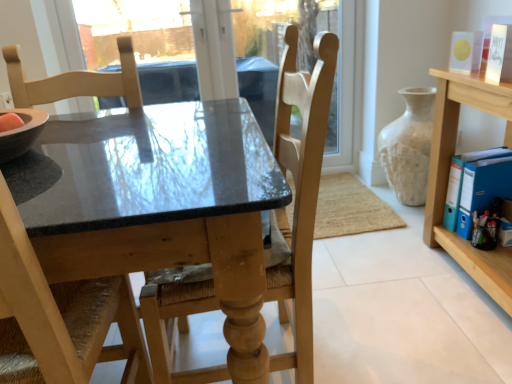
Describe the element at coordinates (157, 194) in the screenshot. This screenshot has height=384, width=512. I see `matte black table at center` at that location.

Describe the element at coordinates (448, 176) in the screenshot. I see `light wood shelf at right` at that location.

What is the approximate width of white textured vase at right?

The width of white textured vase at right is 14.23 inches.

What do you see at coordinates (409, 146) in the screenshot? This screenshot has width=512, height=384. I see `white textured vase at right` at bounding box center [409, 146].

The height and width of the screenshot is (384, 512). What are the coordinates of `wooden chair at center, placed as the 2th chair when sorted from left to right` in the screenshot? It's located at (300, 190).

Is white textured vase at right surrounded by wooden chair at center, placed as the 2th chair when sorted from left to right?

Definitely not — white textured vase at right is not inside wooden chair at center, placed as the 2th chair when sorted from left to right.

From the image's perspective, would you say wooden chair at center, the 1th chair when ordered from right to left, is positioned over white textured vase at right?

No, from the image's perspective, wooden chair at center, the 1th chair when ordered from right to left, is not over white textured vase at right.

Is wooden chair at center, the 1th chair when ordered from right to left, shorter than white textured vase at right?

Incorrect, the height of wooden chair at center, the 1th chair when ordered from right to left, does not fall short of that of white textured vase at right.

Is wooden chair at center, placed as the 2th chair when sorted from left to right, oriented towards white textured vase at right?

No.

Between white textured vase at right and light wood shelf at right, which one appears on the left side from the viewer's perspective?

white textured vase at right.

From a real-world perspective, is white textured vase at right on top of light wood shelf at right?

No.

Is white textured vase at right bigger than light wood shelf at right?

Actually, white textured vase at right might be smaller than light wood shelf at right.

Between white textured vase at right and light wood shelf at right, which one is positioned behind?

white textured vase at right is further from the camera.

From a real-world perspective, is wooden chair at center, the 1th chair when ordered from right to left, positioned over light wood shelf at right based on gravity?

Yes, from a real-world perspective, wooden chair at center, the 1th chair when ordered from right to left, is above light wood shelf at right.

Can light wood shelf at right be found inside wooden chair at center, the 1th chair when ordered from right to left?

No, light wood shelf at right is located outside of wooden chair at center, the 1th chair when ordered from right to left.

From the image's perspective, which one is positioned higher, wooden chair at center, placed as the 2th chair when sorted from left to right, or light wood shelf at right?

light wood shelf at right is shown above in the image.

Is point (297, 305) farther from camera compared to point (447, 180)?

No.

Considering the relative sizes of white textured vase at right and wooden chair at center, the 1th chair when ordered from right to left, in the image provided, is white textured vase at right smaller than wooden chair at center, the 1th chair when ordered from right to left,?

Yes, white textured vase at right is smaller than wooden chair at center, the 1th chair when ordered from right to left.

At what (x,y) coordinates should I click in order to perform the action: click on the 1st chair in front of the white textured vase at right. Please return your answer as a coordinate pair (x, y). Looking at the image, I should click on (300, 190).

From a real-world perspective, which is physically below, white textured vase at right or wooden chair at center, placed as the 2th chair when sorted from left to right?

In real-world perspective, white textured vase at right is lower.

Looking at this image, is white textured vase at right thinner than wooden chair at center, the 1th chair when ordered from right to left?

Yes.

This screenshot has width=512, height=384. In order to click on shelf located above the matte black table at center (from the image's perspective) in this screenshot , I will do `click(448, 176)`.

Does matte black table at center have a lesser height compared to light wood shelf at right?

Yes.

Is point (177, 133) closer or farther from the camera than point (453, 239)?

Point (177, 133).

Considering the positions of point (89, 313) and point (430, 128), is point (89, 313) closer or farther from the camera than point (430, 128)?

Point (89, 313) is positioned closer to the camera compared to point (430, 128).

Which object is positioned more to the right, light wood chair at left, the 2th chair when ordered from right to left, or white textured vase at right?

white textured vase at right is more to the right.

Is light wood chair at left, the 2th chair when ordered from right to left, far from white textured vase at right?

light wood chair at left, the 2th chair when ordered from right to left, is far away from white textured vase at right.

This screenshot has width=512, height=384. I want to click on glass vase on the right of light wood chair at left, which ranks as the first chair in left-to-right order, so click(x=409, y=146).

Between point (456, 133) and point (73, 136), which one is positioned in front?

The point (73, 136) is closer.

Is light wood shelf at right further to camera compared to matte black table at center?

Yes, it is.

Is light wood shelf at right looking in the opposite direction of matte black table at center?

No.

Where is `glass vase located above the wooden chair at center, placed as the 2th chair when sorted from left to right (from the image's perspective)`? The image size is (512, 384). glass vase located above the wooden chair at center, placed as the 2th chair when sorted from left to right (from the image's perspective) is located at coordinates (409, 146).

Find the location of `shelf above the white textured vase at right (from a real-world perspective)`. shelf above the white textured vase at right (from a real-world perspective) is located at coordinates (448, 176).

Which object lies further to the anchor point wooden chair at center, placed as the 2th chair when sorted from left to right, matte black table at center or light wood chair at left, which ranks as the first chair in left-to-right order?

The object further to wooden chair at center, placed as the 2th chair when sorted from left to right, is light wood chair at left, which ranks as the first chair in left-to-right order.

Which object lies nearer to the anchor point light wood chair at left, the 2th chair when ordered from right to left, white textured vase at right or wooden chair at center, the 1th chair when ordered from right to left?

Based on the image, wooden chair at center, the 1th chair when ordered from right to left, appears to be nearer to light wood chair at left, the 2th chair when ordered from right to left.

Looking at this image, which object lies nearer to the anchor point wooden chair at center, the 1th chair when ordered from right to left, light wood shelf at right or white textured vase at right?

light wood shelf at right is closer to wooden chair at center, the 1th chair when ordered from right to left.

Based on their spatial positions, is light wood chair at left, which ranks as the first chair in left-to-right order, or white textured vase at right further from wooden chair at center, the 1th chair when ordered from right to left?

white textured vase at right is further to wooden chair at center, the 1th chair when ordered from right to left.

From the image, which object appears to be nearer to white textured vase at right, light wood chair at left, the 2th chair when ordered from right to left, or matte black table at center?

matte black table at center.

From the image, which object appears to be nearer to wooden chair at center, the 1th chair when ordered from right to left, white textured vase at right or light wood chair at left, the 2th chair when ordered from right to left?

light wood chair at left, the 2th chair when ordered from right to left, is positioned closer to the anchor wooden chair at center, the 1th chair when ordered from right to left.

Which object lies further to the anchor point light wood chair at left, which ranks as the first chair in left-to-right order, wooden chair at center, placed as the 2th chair when sorted from left to right, or white textured vase at right?

white textured vase at right lies further to light wood chair at left, which ranks as the first chair in left-to-right order, than the other object.

Looking at this image, from the image, which object appears to be nearer to light wood chair at left, which ranks as the first chair in left-to-right order, wooden chair at center, placed as the 2th chair when sorted from left to right, or matte black table at center?

matte black table at center is positioned closer to the anchor light wood chair at left, which ranks as the first chair in left-to-right order.

You are a GUI agent. You are given a task and a screenshot of the screen. Output one action in this format:
    pyautogui.click(x=<x>, y=<y>)
    Task: Click on the chair located between matte black table at center and white textured vase at right in the depth direction
    
    Given the screenshot: What is the action you would take?
    pyautogui.click(x=300, y=190)

You are a GUI agent. You are given a task and a screenshot of the screen. Output one action in this format:
    pyautogui.click(x=<x>, y=<y>)
    Task: Click on the glass vase between matte black table at center and light wood shelf at right from left to right
    This screenshot has height=384, width=512.
    Given the screenshot: What is the action you would take?
    pyautogui.click(x=409, y=146)

Locate an element on the screen. This screenshot has width=512, height=384. glass vase between light wood chair at left, which ranks as the first chair in left-to-right order, and light wood shelf at right, in the horizontal direction is located at coordinates (409, 146).

This screenshot has height=384, width=512. What are the coordinates of `chair located between light wood chair at left, which ranks as the first chair in left-to-right order, and light wood shelf at right in the left-right direction` in the screenshot? It's located at pyautogui.click(x=300, y=190).